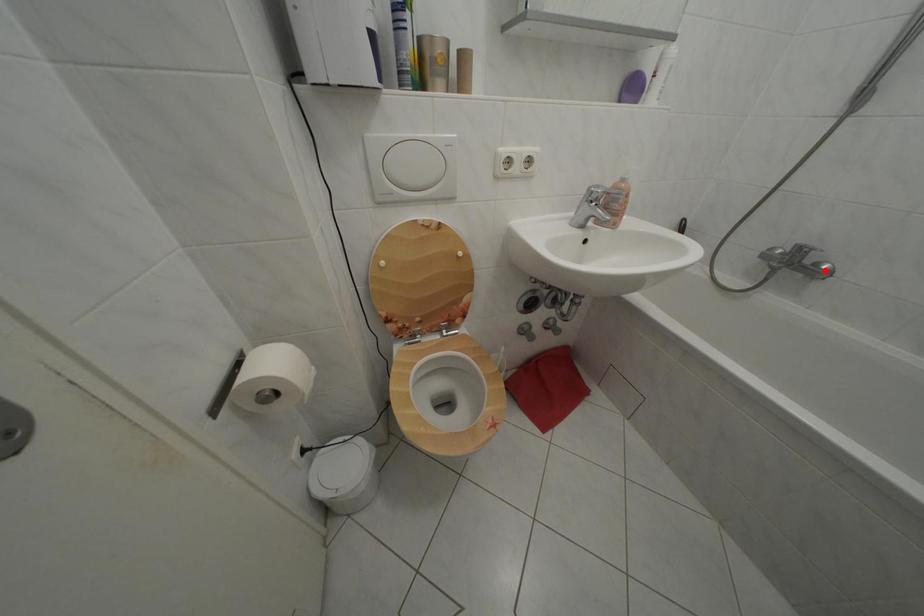
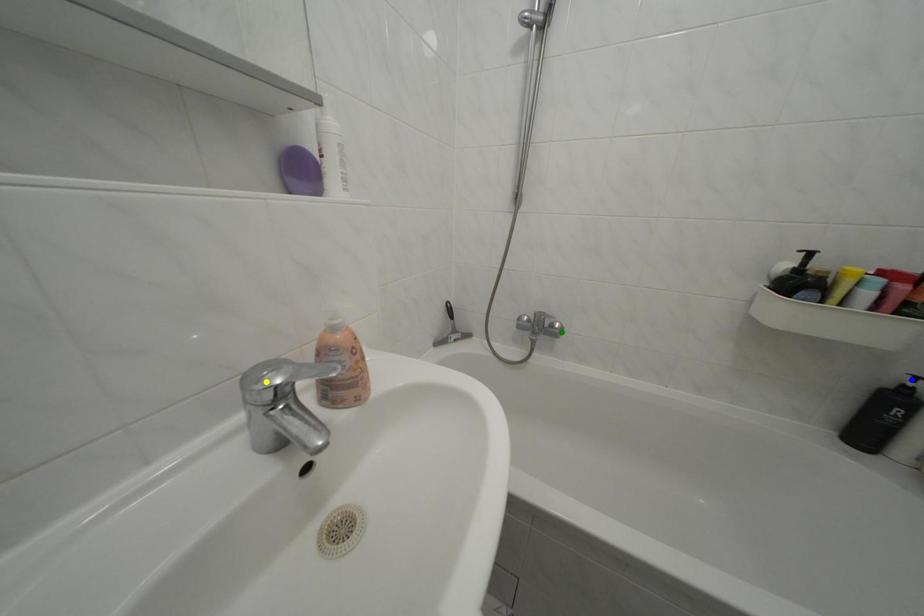
Question: I am providing you with two images of the same scene from different viewpoints. A red point is marked on the first image. You are given multiple points on the second image. Which spot in image 2 lines up with the point in image 1?

Choices:
 (A) green point
 (B) yellow point
 (C) blue point

Answer: (A)